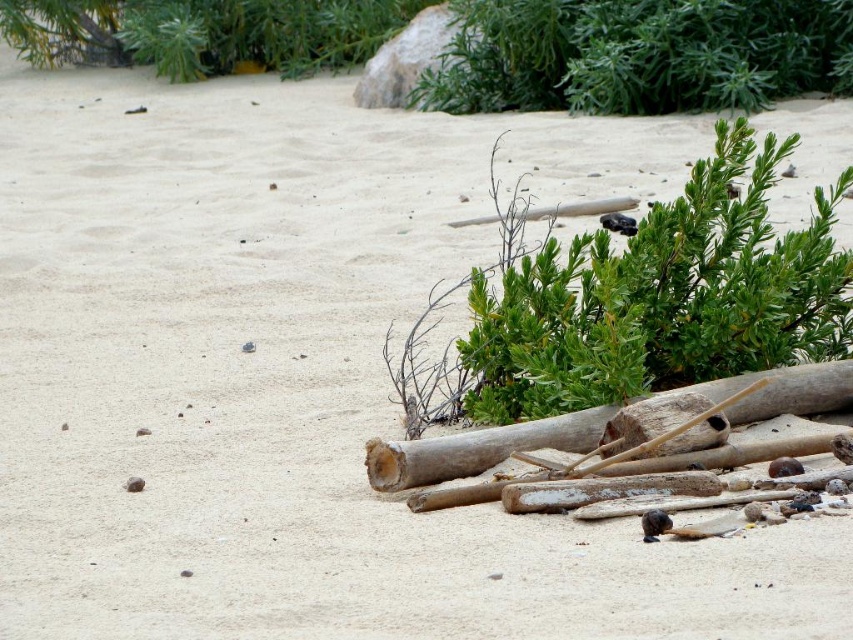
Can you confirm if green leafy bush at upper center is wider than white weathered log at lower right?

Correct, the width of green leafy bush at upper center exceeds that of white weathered log at lower right.

From the picture: Is green leafy bush at upper center behind white weathered log at lower right?

Yes, it is.

Is point (648, 60) less distant than point (747, 404)?

No, it is behind (747, 404).

This screenshot has height=640, width=853. I want to click on green leafy bush at upper center, so click(x=637, y=54).